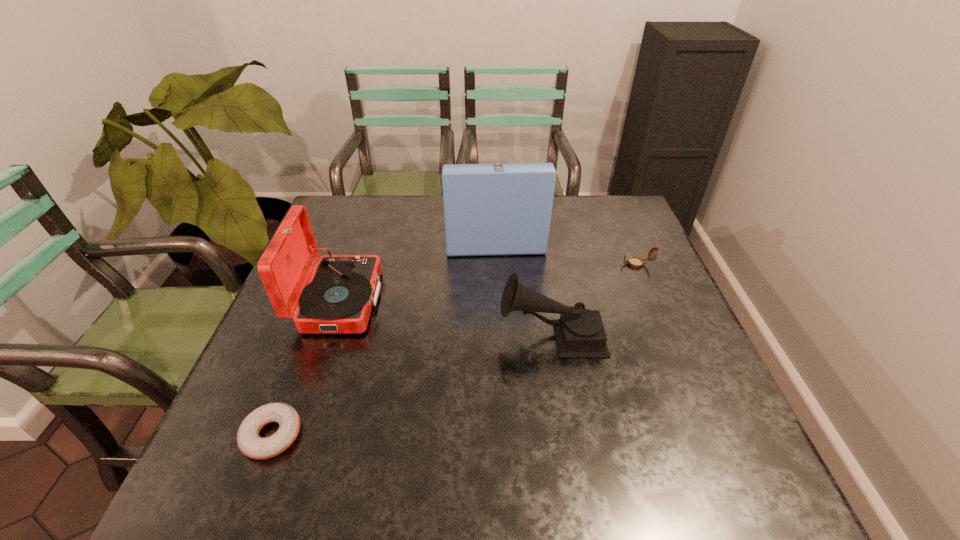
Locate an element on the screen. the farthest object is located at coordinates (495, 209).

Identify the location of the tallest object. The width and height of the screenshot is (960, 540). (495, 209).

Locate an element on the screen. The image size is (960, 540). the second shortest phonograph_record is located at coordinates (342, 289).

Identify the location of the fourth shortest object. This screenshot has width=960, height=540. (342, 289).

This screenshot has width=960, height=540. Identify the location of the third shortest object. (579, 333).

The image size is (960, 540). I want to click on compass, so click(x=635, y=262).

Locate an element on the screen. The image size is (960, 540). the second shortest object is located at coordinates (635, 262).

Where is `the nearest object`? The height and width of the screenshot is (540, 960). the nearest object is located at coordinates (249, 442).

This screenshot has width=960, height=540. Find the location of `doughnut`. doughnut is located at coordinates (249, 442).

Identify the location of vacant space located on the front of the tallest phonograph_record. (498, 316).